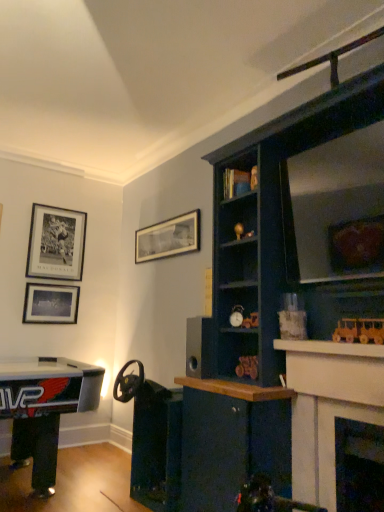
This screenshot has height=512, width=384. I want to click on vacant area on top of white glossy fireplace at upper right, acting as the 1th fireplace starting from the left (from a real-world perspective), so click(329, 356).